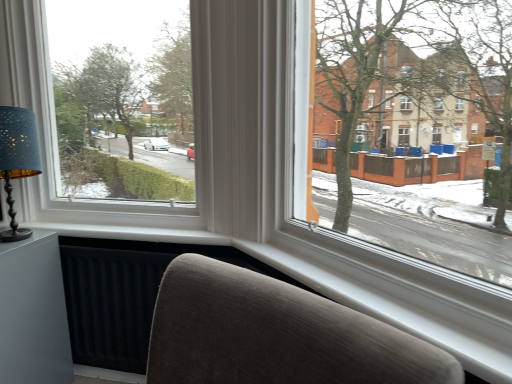
You are a GUI agent. You are given a task and a screenshot of the screen. Output one action in this format:
    pyautogui.click(x=<x>, y=<y>)
    Task: Click on the free space above matte gray table at lower left (from a real-world perspective)
    This screenshot has width=512, height=384.
    Given the screenshot: What is the action you would take?
    pyautogui.click(x=20, y=240)